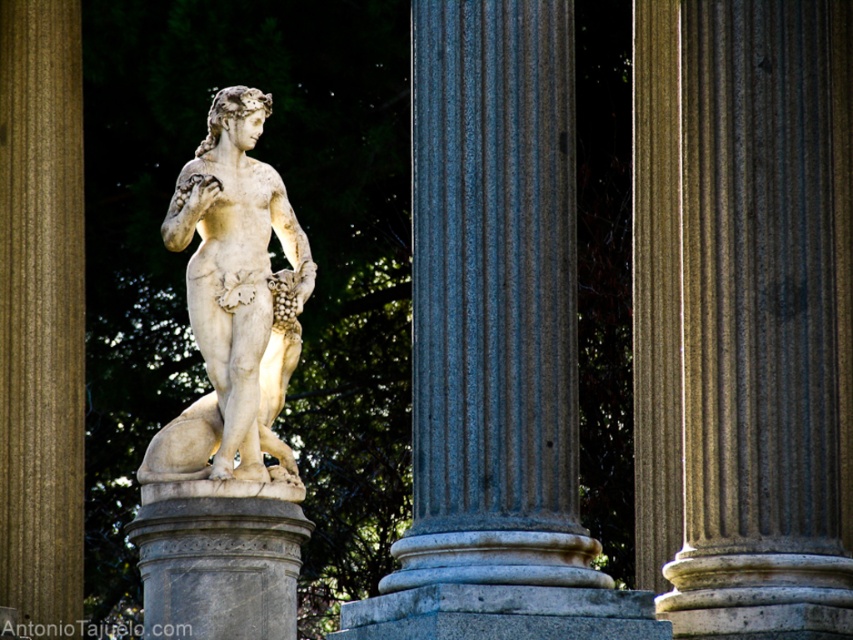
Is smooth gray column at center positioned behind white marble statue at center?

Yes.

Is smooth gray column at center in front of white marble statue at center?

No, it is behind white marble statue at center.

Which is in front, point (28, 541) or point (247, 384)?

Point (247, 384)

Locate an element on the screen. This screenshot has width=853, height=640. smooth gray column at center is located at coordinates (41, 316).

Does smooth beige column at center appear under smooth gray column at center?

Correct, smooth beige column at center is located below smooth gray column at center.

Does smooth beige column at center appear over smooth gray column at center?

Incorrect, smooth beige column at center is not positioned above smooth gray column at center.

Who is more distant from viewer, [782,67] or [26,592]?

Positioned behind is point [26,592].

Locate an element on the screen. This screenshot has height=640, width=853. smooth beige column at center is located at coordinates (744, 314).

Between smooth beige column at center and white marble statue at center, which one has less height?

white marble statue at center

Can you confirm if smooth beige column at center is thinner than white marble statue at center?

Incorrect, smooth beige column at center's width is not less than white marble statue at center's.

Is point (672, 282) behind point (254, 138)?

No, (672, 282) is closer to viewer.

You are a GUI agent. You are given a task and a screenshot of the screen. Output one action in this format:
    pyautogui.click(x=<x>, y=<y>)
    Task: Click on the smooth beige column at center
    The height and width of the screenshot is (640, 853).
    Given the screenshot: What is the action you would take?
    pyautogui.click(x=744, y=314)